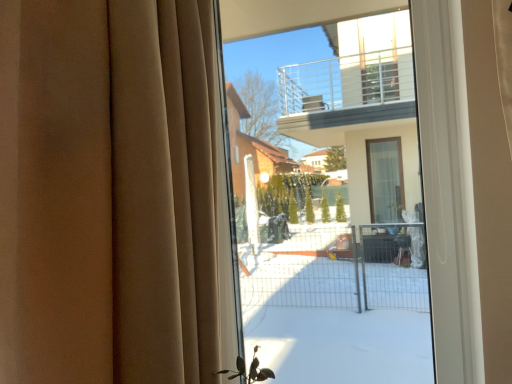
Question: Considering the positions of point (25, 208) and point (395, 142), is point (25, 208) closer or farther from the camera than point (395, 142)?

Choices:
 (A) closer
 (B) farther

Answer: (A)

Question: From a real-world perspective, is beige fabric curtain at left positioned above or below transparent glass bay window at center?

Choices:
 (A) below
 (B) above

Answer: (B)

Question: In terms of height, does beige fabric curtain at left look taller or shorter compared to transparent glass bay window at center?

Choices:
 (A) tall
 (B) short

Answer: (B)

Question: Considering the positions of transparent glass bay window at center and beige fabric curtain at left in the image, is transparent glass bay window at center taller or shorter than beige fabric curtain at left?

Choices:
 (A) tall
 (B) short

Answer: (A)

Question: Visually, is transparent glass bay window at center positioned to the left or to the right of beige fabric curtain at left?

Choices:
 (A) right
 (B) left

Answer: (A)

Question: Considering the positions of transparent glass bay window at center and beige fabric curtain at left in the image, is transparent glass bay window at center bigger or smaller than beige fabric curtain at left?

Choices:
 (A) big
 (B) small

Answer: (B)

Question: Considering the positions of transparent glass bay window at center and beige fabric curtain at left in the image, is transparent glass bay window at center wider or thinner than beige fabric curtain at left?

Choices:
 (A) wide
 (B) thin

Answer: (B)